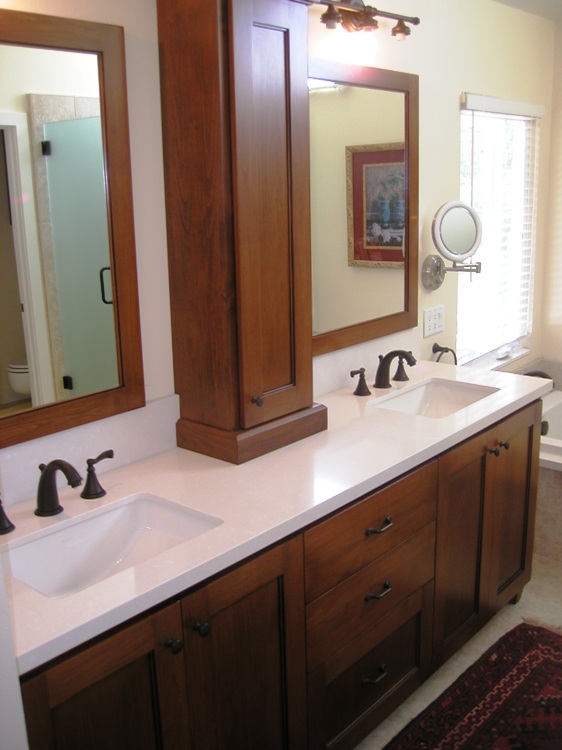
The image size is (562, 750). Find the location of `bathtub`. bathtub is located at coordinates (552, 434).